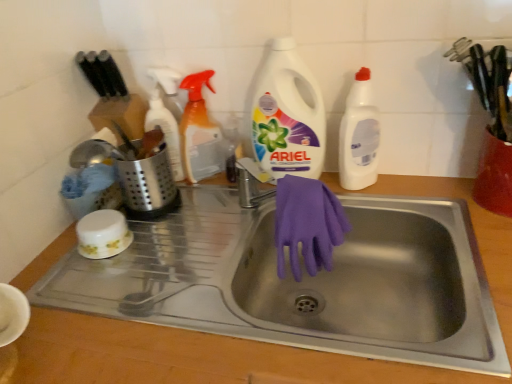
Question: From their relative heights in the image, would you say translucent orange spray bottle at upper center, which appears as the second cleaning product when viewed from the left, is taller or shorter than purple rubber gloves at sink?

Choices:
 (A) tall
 (B) short

Answer: (A)

Question: Is translucent orange spray bottle at upper center, marked as the third cleaning product in a right-to-left arrangement, in front of or behind purple rubber gloves at sink in the image?

Choices:
 (A) front
 (B) behind

Answer: (B)

Question: Considering the real-world distances, which object is farthest from the white plastic bottle at upper right, the 1th cleaning product in the right-to-left sequence?

Choices:
 (A) translucent orange spray bottle at upper center, marked as the third cleaning product in a right-to-left arrangement
 (B) purple rubber gloves at sink
 (C) satin silver utensil holder at left, marked as the 1th appliance in a left-to-right arrangement
 (D) stainless steel sink at center
 (E) white plastic detergent at center, acting as the 2th cleaning product starting from the right

Answer: (C)

Question: Based on their relative distances, which object is farther from the white plastic bottle at upper right, which is counted as the fourth cleaning product, starting from the left?

Choices:
 (A) translucent plastic spray bottle at upper center, positioned as the fourth cleaning product in right-to-left order
 (B) satin silver utensil holder at left, which is counted as the 2th appliance, starting from the right
 (C) translucent orange spray bottle at upper center, marked as the third cleaning product in a right-to-left arrangement
 (D) purple rubber gloves at sink
 (E) white plastic detergent at center, acting as the 2th cleaning product starting from the right

Answer: (B)